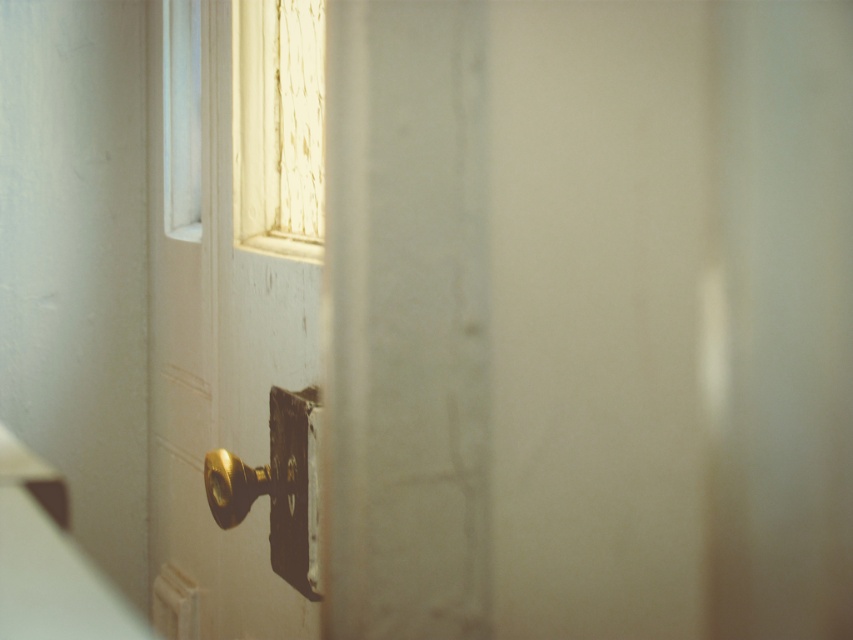
Does white matte door handle at center appear on the left side of wooden textured window at upper left?

Indeed, white matte door handle at center is positioned on the left side of wooden textured window at upper left.

Measure the distance between point (216, 28) and camera.

Point (216, 28) and camera are 5.28 feet apart from each other.

Identify the location of white matte door handle at center. The image size is (853, 640). (225, 296).

The width and height of the screenshot is (853, 640). In order to click on white matte door handle at center in this screenshot , I will do `click(225, 296)`.

Can you confirm if white matte door handle at center is shorter than gold polished metal door handle at center?

In fact, white matte door handle at center may be taller than gold polished metal door handle at center.

Is point (233, 426) positioned in front of point (310, 509)?

No, it is behind (310, 509).

Where is `white matte door handle at center`? This screenshot has height=640, width=853. white matte door handle at center is located at coordinates pyautogui.click(x=225, y=296).

Does wooden textured window at upper left have a larger size compared to gold polished metal door handle at center?

Yes, wooden textured window at upper left is bigger than gold polished metal door handle at center.

Which is behind, point (311, 241) or point (305, 416)?

Point (311, 241)

In order to click on wooden textured window at upper left in this screenshot , I will do `click(277, 124)`.